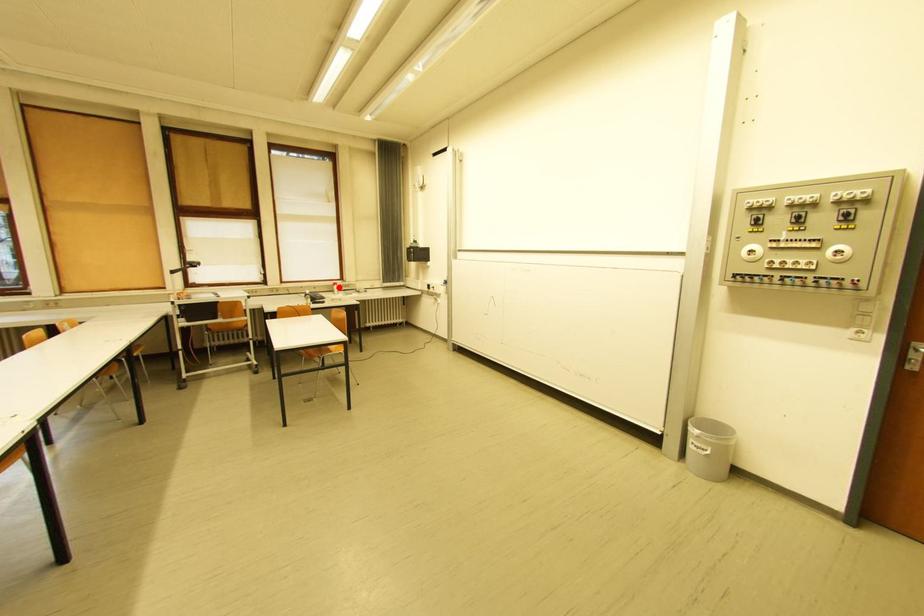
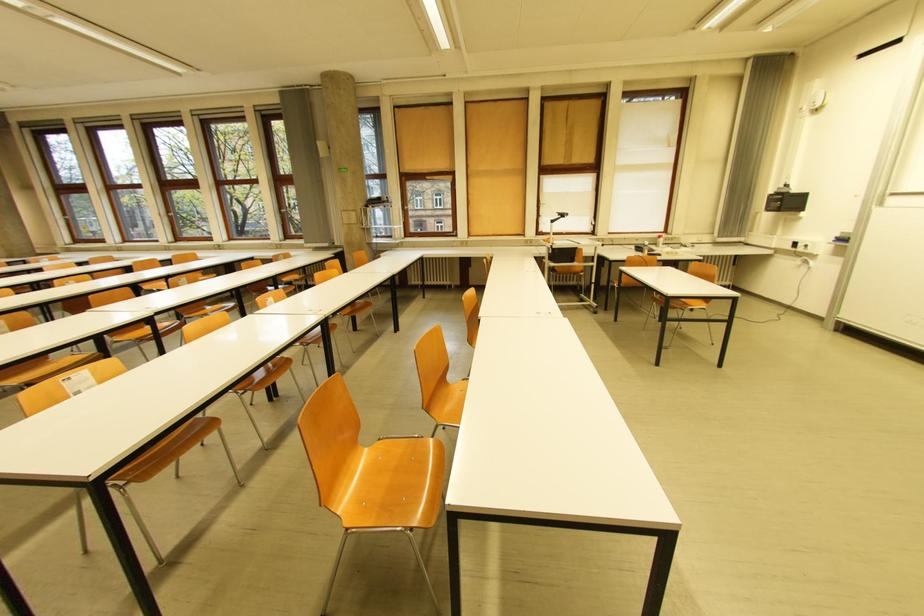
Locate, in the second image, the point that corresponds to the highlighted location in the first image.

(662, 240)